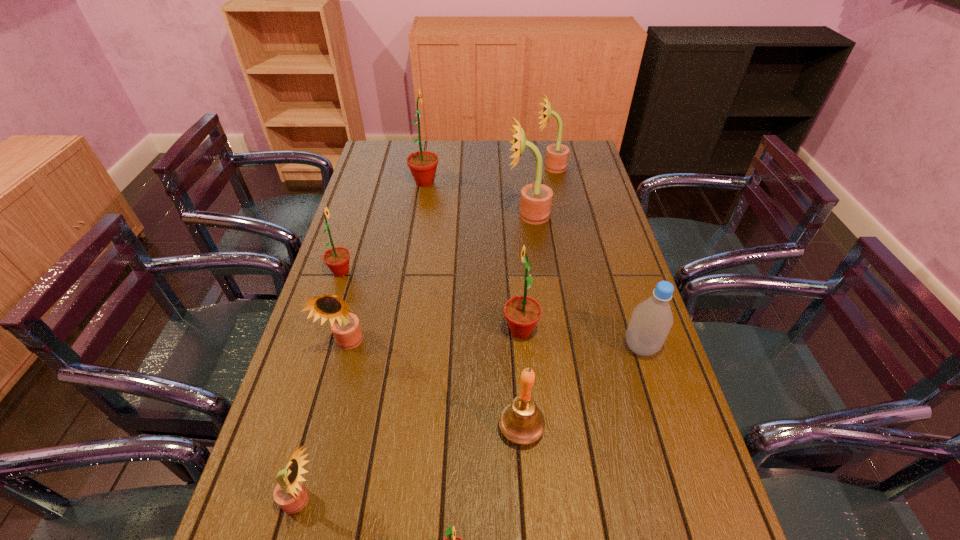
Locate an element on the screen. the biggest yellow sunflower is located at coordinates (536, 199).

At what (x,y) coordinates should I click in order to perform the action: click on the eighth nearest object. Please return your answer as a coordinate pair (x, y). The width and height of the screenshot is (960, 540). Looking at the image, I should click on (536, 199).

At what (x,y) coordinates should I click in order to perform the action: click on the fourth sunflower from left to right. Please return your answer as a coordinate pair (x, y). This screenshot has height=540, width=960. Looking at the image, I should click on (423, 164).

You are a GUI agent. You are given a task and a screenshot of the screen. Output one action in this format:
    pyautogui.click(x=<x>, y=<y>)
    Task: Click on the seventh object from right to left
    The width and height of the screenshot is (960, 540).
    Given the screenshot: What is the action you would take?
    pyautogui.click(x=423, y=164)

Identify the location of the farthest yellow sunflower. This screenshot has width=960, height=540. coord(557,154).

Image resolution: width=960 pixels, height=540 pixels. What are the coordinates of `the rightmost green sunflower` in the screenshot? It's located at (522, 313).

Image resolution: width=960 pixels, height=540 pixels. Identify the location of the third farthest green sunflower. (522, 313).

The width and height of the screenshot is (960, 540). Identify the location of the second farthest green sunflower. pyautogui.click(x=337, y=259).

You are a GUI agent. You are given a task and a screenshot of the screen. Output one action in this format:
    pyautogui.click(x=<x>, y=<y>)
    Task: Click on the seventh nearest object
    
    Given the screenshot: What is the action you would take?
    pyautogui.click(x=337, y=259)

This screenshot has width=960, height=540. Identify the location of the second smallest yellow sunflower. (345, 326).